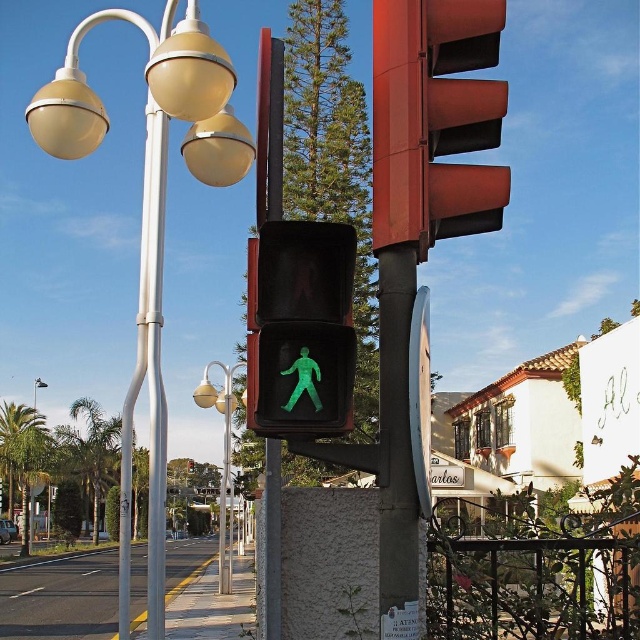
Based on the photo, you are a delivery robot with a 2.5 meter wide package on your tray. You need to move from the matte white street light at left to the green plastic pedestrian at center. Can you navigate the space between them without tilting the package?

The distance between the matte white street light at left and the green plastic pedestrian at center is 4.96 meters. Since your package is 2.5 meters wide, the space between them is sufficient as 4.96 meters is greater than 2.5 meters. Therefore, you can navigate safely without tilting the package.

You are a pedestrian standing at the crosswalk and want to locate the matte white street light at left. According to the coordinates provided, where should you look relative to the pedestrian crossing signal?

The matte white street light at left is located at coordinates point (150, 220) relative to the pedestrian crossing signal.

You are a pedestrian wanting to cross the street. You see the metallic red traffic light at upper center and the green plastic pedestrian at center. Which object is closer to you?

The metallic red traffic light at upper center is closer to you because the green plastic pedestrian at center is behind it.